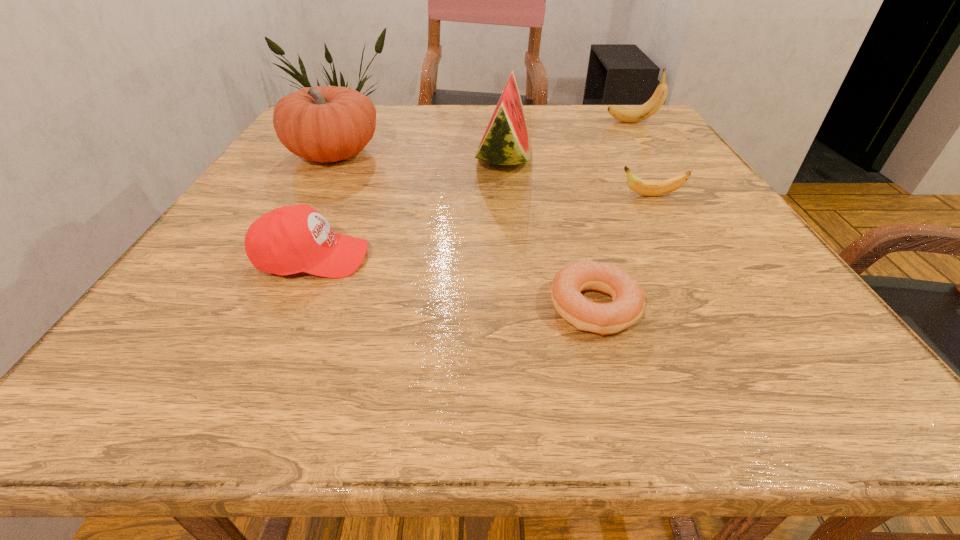
Identify the location of vacant space situated 0.150m on the outer rind of the tallest object. This screenshot has width=960, height=540. (411, 157).

I want to click on vacant space located on the right of the pumpkin, so (423, 154).

This screenshot has height=540, width=960. I want to click on vacant position located 0.190m at the start of the peel on the farther banana, so click(536, 122).

You are a GUI agent. You are given a task and a screenshot of the screen. Output one action in this format:
    pyautogui.click(x=<x>, y=<y>)
    Task: Click on the vacant space located 0.370m at the start of the peel on the farther banana
    The image size is (960, 540).
    Given the screenshot: What is the action you would take?
    pyautogui.click(x=468, y=122)

At what (x,y) coordinates should I click in order to perform the action: click on free spot located 0.110m at the start of the peel on the farther banana. Please return your answer as a coordinate pair (x, y). The width and height of the screenshot is (960, 540). Looking at the image, I should click on (564, 122).

The image size is (960, 540). I want to click on free space located on the front panel of the baseball cap, so click(x=580, y=258).

This screenshot has height=540, width=960. In order to click on vacant space positioned 0.360m at the stem of the nearer banana in this screenshot , I will do `click(443, 195)`.

This screenshot has width=960, height=540. What are the coordinates of `free space located 0.290m at the stem of the nearer banana` in the screenshot? It's located at (477, 195).

The width and height of the screenshot is (960, 540). I want to click on free space located at the stem of the nearer banana, so click(536, 195).

Locate an element on the screen. free region located on the back of the shortest object is located at coordinates (560, 179).